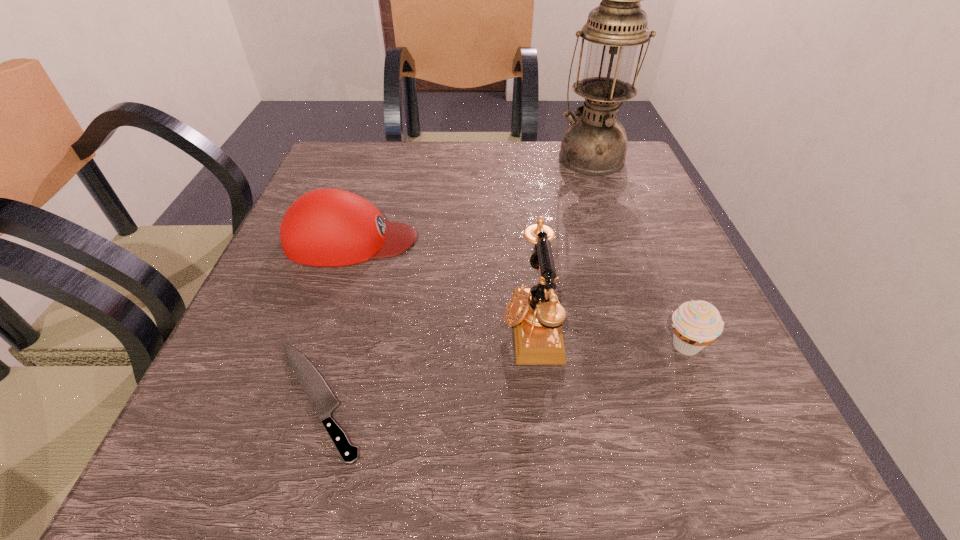
Locate an element on the screen. vacant region located on the dial of the telephone is located at coordinates (396, 326).

Find the location of a particular element. This screenshot has width=960, height=540. vacant point located 0.070m on the front-facing side of the second farthest object is located at coordinates (454, 240).

The image size is (960, 540). Find the location of `free space located on the left of the muffin`. free space located on the left of the muffin is located at coordinates (465, 346).

Locate an element on the screen. free spot located 0.090m on the right of the shortest object is located at coordinates (437, 399).

Where is `object situated at the far edge`? object situated at the far edge is located at coordinates (595, 143).

You are a GUI agent. You are given a task and a screenshot of the screen. Output one action in this format:
    pyautogui.click(x=<x>, y=<y>)
    Task: Click on the object at the near edge
    This screenshot has width=960, height=540.
    Given the screenshot: What is the action you would take?
    pyautogui.click(x=323, y=401)

Where is `baseball cap located in the left edge section of the desktop`? The height and width of the screenshot is (540, 960). baseball cap located in the left edge section of the desktop is located at coordinates (327, 227).

Find the location of a particular element. steak knife located in the left edge section of the desktop is located at coordinates (323, 401).

Locate an element on the screen. oil lamp situated at the right edge is located at coordinates (595, 143).

Find the location of a particular element. The height and width of the screenshot is (540, 960). muffin located at the right edge is located at coordinates (696, 324).